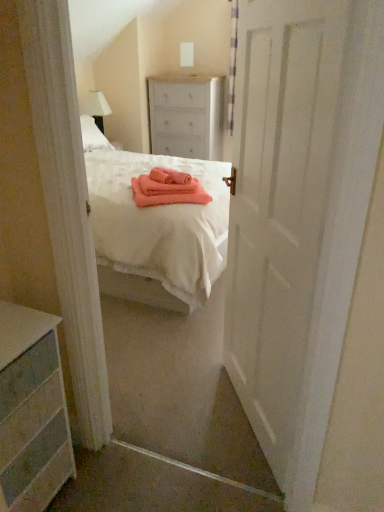
Question: Is white painted wood chest of drawers at center, which is the 2th chest of drawers from left to right, positioned beyond the bounds of pink fabric at center?

Choices:
 (A) no
 (B) yes

Answer: (B)

Question: From the image's perspective, does white painted wood chest of drawers at center, the second chest of drawers ordered from the bottom, appear lower than pink fabric at center?

Choices:
 (A) no
 (B) yes

Answer: (A)

Question: From a real-world perspective, is white painted wood chest of drawers at center, arranged as the first chest of drawers when viewed from the right, positioned under pink fabric at center based on gravity?

Choices:
 (A) no
 (B) yes

Answer: (A)

Question: From a real-world perspective, is white painted wood chest of drawers at center, arranged as the first chest of drawers when viewed from the right, physically above pink fabric at center?

Choices:
 (A) yes
 (B) no

Answer: (A)

Question: Does white painted wood chest of drawers at center, arranged as the 1th chest of drawers when viewed from the back, turn towards pink fabric at center?

Choices:
 (A) no
 (B) yes

Answer: (B)

Question: Is white fabric lampshade at upper left taller or shorter than white painted wood chest of drawers at center, arranged as the 1th chest of drawers when viewed from the back?

Choices:
 (A) tall
 (B) short

Answer: (B)

Question: From the image's perspective, is white fabric lampshade at upper left above or below white painted wood chest of drawers at center, which appears as the second chest of drawers when viewed from the front?

Choices:
 (A) below
 (B) above

Answer: (A)

Question: Is white fabric lampshade at upper left in front of or behind white painted wood chest of drawers at center, which appears as the second chest of drawers when viewed from the front, in the image?

Choices:
 (A) behind
 (B) front

Answer: (B)

Question: Visually, is white fabric lampshade at upper left positioned to the left or to the right of white painted wood chest of drawers at center, arranged as the first chest of drawers when viewed from the right?

Choices:
 (A) left
 (B) right

Answer: (A)

Question: Considering the positions of white painted wood dresser at lower left, arranged as the first chest of drawers when viewed from the front, and pink fabric at center in the image, is white painted wood dresser at lower left, arranged as the first chest of drawers when viewed from the front, wider or thinner than pink fabric at center?

Choices:
 (A) wide
 (B) thin

Answer: (A)

Question: Is white painted wood dresser at lower left, placed as the second chest of drawers when sorted from back to front, bigger or smaller than pink fabric at center?

Choices:
 (A) small
 (B) big

Answer: (B)

Question: Considering the positions of point (51, 464) and point (165, 167), is point (51, 464) closer or farther from the camera than point (165, 167)?

Choices:
 (A) closer
 (B) farther

Answer: (A)

Question: Considering their positions, is white painted wood dresser at lower left, the second chest of drawers when ordered from top to bottom, located in front of or behind pink fabric at center?

Choices:
 (A) behind
 (B) front

Answer: (B)

Question: From a real-world perspective, is white painted wood chest of drawers at center, which appears as the second chest of drawers when viewed from the front, positioned above or below pink fabric at center?

Choices:
 (A) below
 (B) above

Answer: (B)

Question: Considering the relative positions of white painted wood chest of drawers at center, positioned as the 1th chest of drawers in top-to-bottom order, and pink fabric at center in the image provided, is white painted wood chest of drawers at center, positioned as the 1th chest of drawers in top-to-bottom order, to the left or to the right of pink fabric at center?

Choices:
 (A) right
 (B) left

Answer: (A)